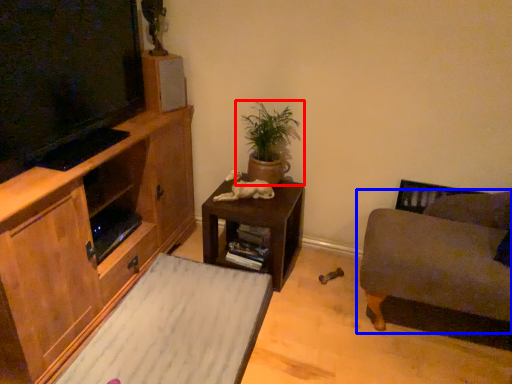
Question: Which object is closer to the camera taking this photo, houseplant (highlighted by a red box) or studio couch (highlighted by a blue box)?

Choices:
 (A) houseplant
 (B) studio couch

Answer: (B)